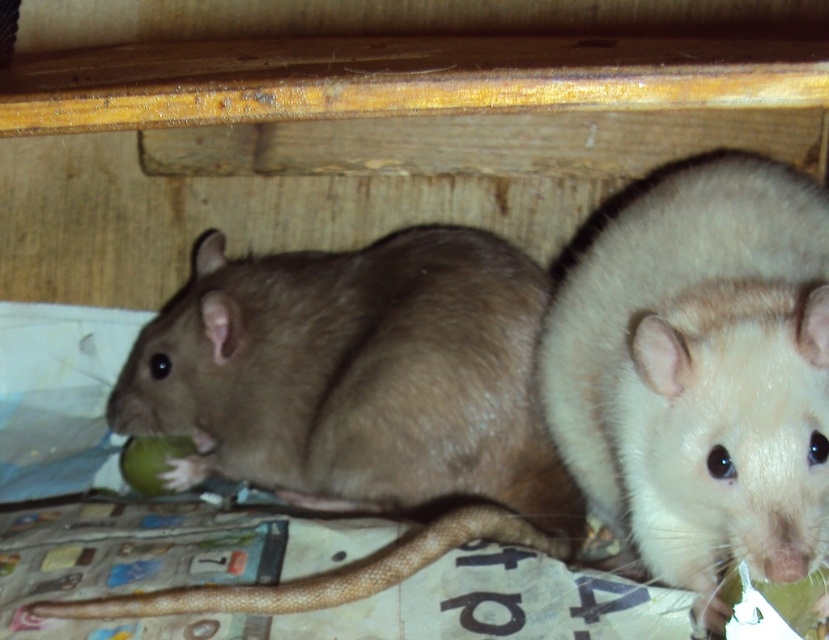
Question: Can you confirm if brown furry mouse at center is bigger than light beige fur hamster at right?

Choices:
 (A) yes
 (B) no

Answer: (A)

Question: Which of the following is the farthest from the observer?

Choices:
 (A) brown furry mouse at center
 (B) light beige fur hamster at right

Answer: (A)

Question: Is brown furry mouse at center in front of light beige fur hamster at right?

Choices:
 (A) yes
 (B) no

Answer: (B)

Question: Does brown furry mouse at center appear under light beige fur hamster at right?

Choices:
 (A) no
 (B) yes

Answer: (B)